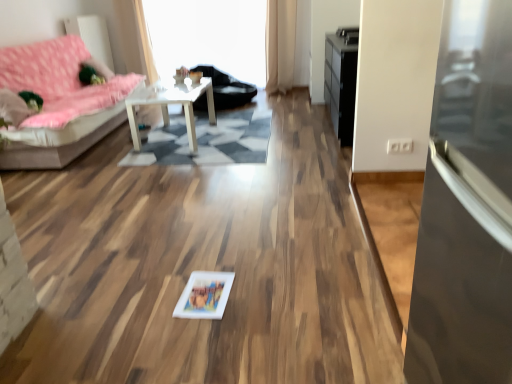
Locate an element on the screen. The height and width of the screenshot is (384, 512). vacant point above white glossy picture frame at center (from a real-world perspective) is located at coordinates (204, 291).